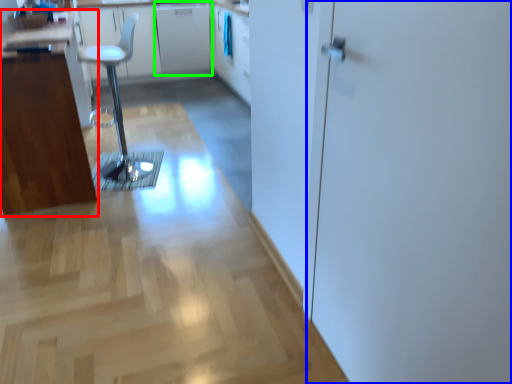
Question: Estimate the real-world distances between objects in this image. Which object is farther from cabinetry (highlighted by a red box), screen door (highlighted by a blue box) or cabinetry (highlighted by a green box)?

Choices:
 (A) screen door
 (B) cabinetry

Answer: (B)